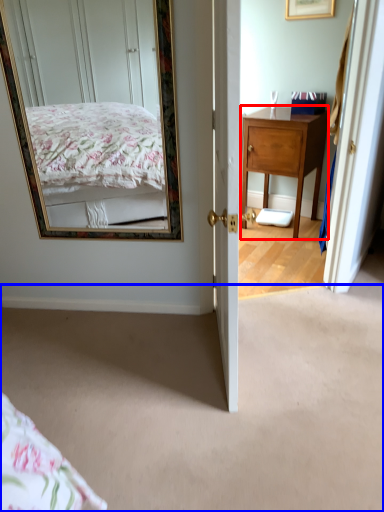
Question: Which of the following is the closest to the observer, desk (highlighted by a red box) or plain (highlighted by a blue box)?

Choices:
 (A) desk
 (B) plain

Answer: (B)